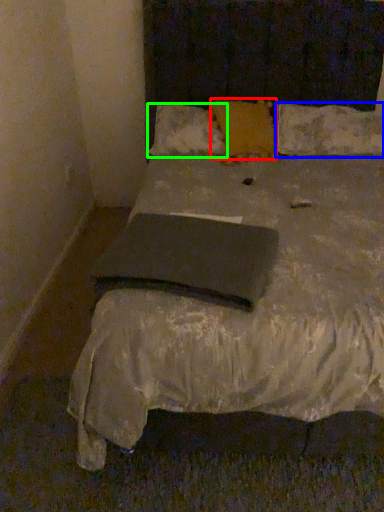
Question: Which is farther away from pillow (highlighted by a red box)? pillow (highlighted by a blue box) or pillow (highlighted by a green box)?

Choices:
 (A) pillow
 (B) pillow

Answer: (A)